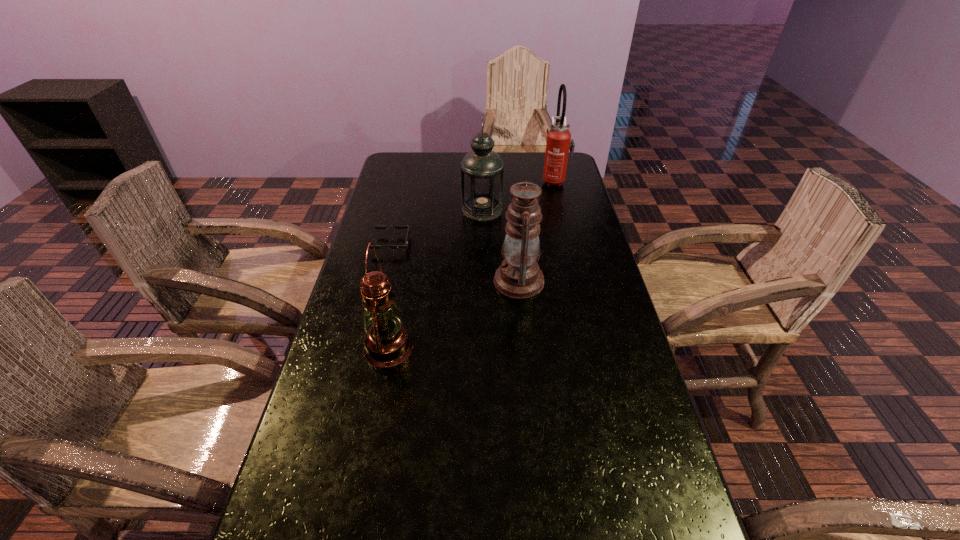
This screenshot has width=960, height=540. I want to click on vacant space located 0.110m at the nozzle of the rightmost object, so click(514, 180).

Locate an element on the screen. Image resolution: width=960 pixels, height=540 pixels. free point located 0.080m on the back of the farthest oil lamp is located at coordinates (482, 188).

Find the location of a particular element. free region located on the back of the second nearest object is located at coordinates click(x=513, y=221).

This screenshot has width=960, height=540. In order to click on free space located 0.090m on the left of the nearest oil lamp in this screenshot , I will do `click(328, 348)`.

Image resolution: width=960 pixels, height=540 pixels. I want to click on vacant space located 0.110m on the temples of the third nearest object, so click(444, 244).

The image size is (960, 540). Identify the location of object that is positioned at the far edge. 559,141.

I want to click on oil lamp at the left edge, so click(x=387, y=343).

In order to click on sunglasses situated at the left edge in this screenshot , I will do `click(405, 246)`.

Locate an element on the screen. The height and width of the screenshot is (540, 960). object that is positioned at the right edge is located at coordinates (559, 141).

Find the location of a particular element. object at the far right corner is located at coordinates (559, 141).